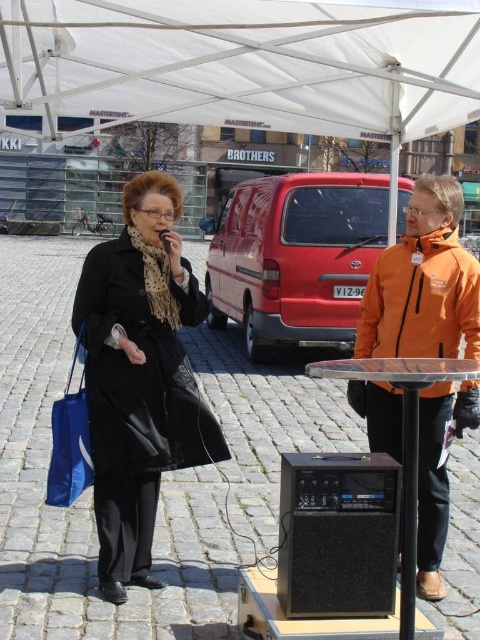
Is white fabric canopy at upper center shorter than black matte speaker at lower center?

Incorrect, white fabric canopy at upper center's height does not fall short of black matte speaker at lower center's.

Can you confirm if white fabric canopy at upper center is wider than black matte speaker at lower center?

Indeed, white fabric canopy at upper center has a greater width compared to black matte speaker at lower center.

This screenshot has height=640, width=480. Describe the element at coordinates (244, 64) in the screenshot. I see `white fabric canopy at upper center` at that location.

At what (x,y) coordinates should I click in order to perform the action: click on white fabric canopy at upper center. Please return your answer as a coordinate pair (x, y). The image size is (480, 640). Looking at the image, I should click on (244, 64).

Between white fabric canopy at upper center and black leather coat at center, which one has more height?

Standing taller between the two is black leather coat at center.

How much distance is there between white fabric canopy at upper center and black leather coat at center?

The distance of white fabric canopy at upper center from black leather coat at center is 2.03 meters.

Image resolution: width=480 pixels, height=640 pixels. What are the coordinates of `white fabric canopy at upper center` in the screenshot? It's located at (244, 64).

Is point (307, 474) positioned after point (165, 241)?

That is False.

Which of these two, black matte speaker at lower center or matte black microphone at center, stands shorter?

With less height is matte black microphone at center.

Identify the location of black matte speaker at lower center. The height and width of the screenshot is (640, 480). (337, 534).